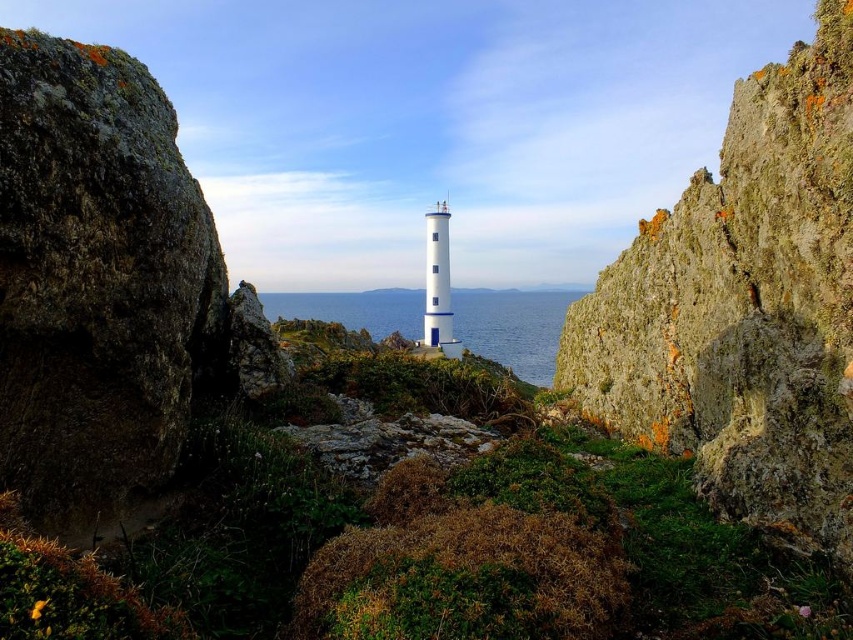
Question: Which point is closer to the camera?

Choices:
 (A) (346, 310)
 (B) (682, 230)

Answer: (B)

Question: Does rusty rock cliff at center right have a smaller size compared to blue water at center?

Choices:
 (A) yes
 (B) no

Answer: (A)

Question: Is rusty rock cliff at center right to the right of blue water at center from the viewer's perspective?

Choices:
 (A) yes
 (B) no

Answer: (B)

Question: Is rusty rock cliff at center right closer to the viewer compared to blue water at center?

Choices:
 (A) no
 (B) yes

Answer: (B)

Question: Which point appears farthest from the camera in this image?

Choices:
 (A) (735, 310)
 (B) (399, 292)

Answer: (B)